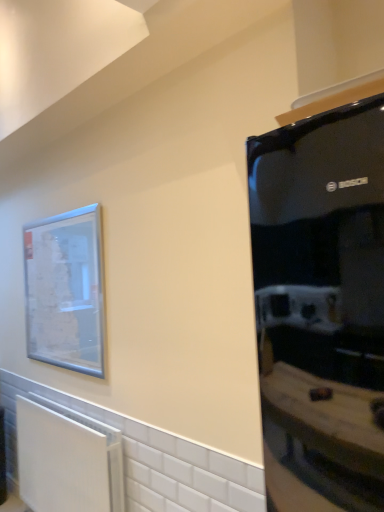
What do you see at coordinates (66, 290) in the screenshot? The width and height of the screenshot is (384, 512). I see `clear glass picture frame at upper left` at bounding box center [66, 290].

What is the approximate width of black glossy refrigerator at right?

It is 25.05 inches.

Find the location of a particular element. This screenshot has height=512, width=384. clear glass picture frame at upper left is located at coordinates (66, 290).

In the scene shown: From the image's perspective, who appears lower, black glossy refrigerator at right or white matte radiator at lower left?

white matte radiator at lower left appears lower in the image.

Would you say black glossy refrigerator at right contains white matte radiator at lower left?

No, white matte radiator at lower left is not surrounded by black glossy refrigerator at right.

Is black glossy refrigerator at right directly adjacent to white matte radiator at lower left?

No, black glossy refrigerator at right is not in contact with white matte radiator at lower left.

You are a GUI agent. You are given a task and a screenshot of the screen. Output one action in this format:
    pyautogui.click(x=<x>, y=<y>)
    Task: Click on the appliance below the clear glass picture frame at upper left (from the image's perspective)
    The width and height of the screenshot is (384, 512).
    Given the screenshot: What is the action you would take?
    pyautogui.click(x=321, y=307)

Is black glossy refrigerator at right at the left side of clear glass picture frame at upper left?

Incorrect, black glossy refrigerator at right is not on the left side of clear glass picture frame at upper left.

Is black glossy refrigerator at right beside clear glass picture frame at upper left?

No, black glossy refrigerator at right is not touching clear glass picture frame at upper left.

Can you confirm if white matte radiator at lower left is thinner than black glossy refrigerator at right?

Yes.

Which is in front, white matte radiator at lower left or black glossy refrigerator at right?

black glossy refrigerator at right is closer to the camera.

From the image's perspective, which one is positioned lower, white matte radiator at lower left or black glossy refrigerator at right?

white matte radiator at lower left.

Is white matte radiator at lower left in contact with black glossy refrigerator at right?

No, white matte radiator at lower left is not next to black glossy refrigerator at right.

Looking at the image, does clear glass picture frame at upper left seem bigger or smaller compared to black glossy refrigerator at right?

clear glass picture frame at upper left is smaller than black glossy refrigerator at right.

Is clear glass picture frame at upper left wider than black glossy refrigerator at right?

Incorrect, the width of clear glass picture frame at upper left does not surpass that of black glossy refrigerator at right.

From a real-world perspective, is clear glass picture frame at upper left below black glossy refrigerator at right?

No, from a real-world perspective, clear glass picture frame at upper left is not beneath black glossy refrigerator at right.

Considering the relative positions of clear glass picture frame at upper left and black glossy refrigerator at right in the image provided, is clear glass picture frame at upper left to the left of black glossy refrigerator at right from the viewer's perspective?

Yes, clear glass picture frame at upper left is to the left of black glossy refrigerator at right.

Considering the relative positions of clear glass picture frame at upper left and white matte radiator at lower left in the image provided, is clear glass picture frame at upper left to the left of white matte radiator at lower left from the viewer's perspective?

Yes.

Measure the distance between clear glass picture frame at upper left and white matte radiator at lower left.

24.71 inches.

Does point (32, 334) appear closer or farther from the camera than point (66, 462)?

Point (32, 334) appears to be farther away from the viewer than point (66, 462).

From a real-world perspective, is clear glass picture frame at upper left positioned above or below white matte radiator at lower left?

From a real-world perspective, clear glass picture frame at upper left is physically above white matte radiator at lower left.

In terms of width, does white matte radiator at lower left look wider or thinner when compared to clear glass picture frame at upper left?

white matte radiator at lower left is wider than clear glass picture frame at upper left.

Considering the sizes of objects white matte radiator at lower left and clear glass picture frame at upper left in the image provided, who is shorter, white matte radiator at lower left or clear glass picture frame at upper left?

white matte radiator at lower left is shorter.

Is white matte radiator at lower left not near clear glass picture frame at upper left?

white matte radiator at lower left is actually quite close to clear glass picture frame at upper left.

Between point (37, 480) and point (74, 285), which one is positioned in front?

The point (74, 285) is closer.

Find the location of `radiator on the left side of black glossy refrigerator at right`. radiator on the left side of black glossy refrigerator at right is located at coordinates (67, 459).

This screenshot has height=512, width=384. Identify the location of appliance on the right of clear glass picture frame at upper left. (321, 307).

When comparing their distances from black glossy refrigerator at right, does white matte radiator at lower left or clear glass picture frame at upper left seem closer?

Among the two, clear glass picture frame at upper left is located nearer to black glossy refrigerator at right.

Looking at this image, based on their spatial positions, is black glossy refrigerator at right or clear glass picture frame at upper left closer to white matte radiator at lower left?

The object closer to white matte radiator at lower left is clear glass picture frame at upper left.

Which object lies further to the anchor point white matte radiator at lower left, clear glass picture frame at upper left or black glossy refrigerator at right?

black glossy refrigerator at right.

Estimate the real-world distances between objects in this image. Which object is closer to black glossy refrigerator at right, clear glass picture frame at upper left or white matte radiator at lower left?

clear glass picture frame at upper left lies closer to black glossy refrigerator at right than the other object.

Which object lies further to the anchor point clear glass picture frame at upper left, white matte radiator at lower left or black glossy refrigerator at right?

The object further to clear glass picture frame at upper left is black glossy refrigerator at right.

Looking at the image, which one is located closer to clear glass picture frame at upper left, black glossy refrigerator at right or white matte radiator at lower left?

white matte radiator at lower left is closer to clear glass picture frame at upper left.

Where is `radiator located between black glossy refrigerator at right and clear glass picture frame at upper left in the depth direction`? The image size is (384, 512). radiator located between black glossy refrigerator at right and clear glass picture frame at upper left in the depth direction is located at coordinates (67, 459).